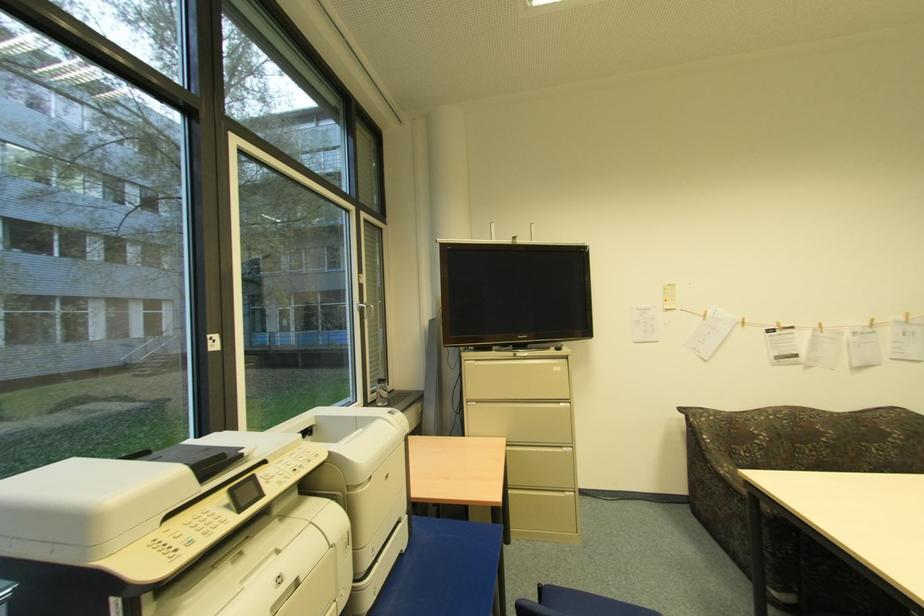
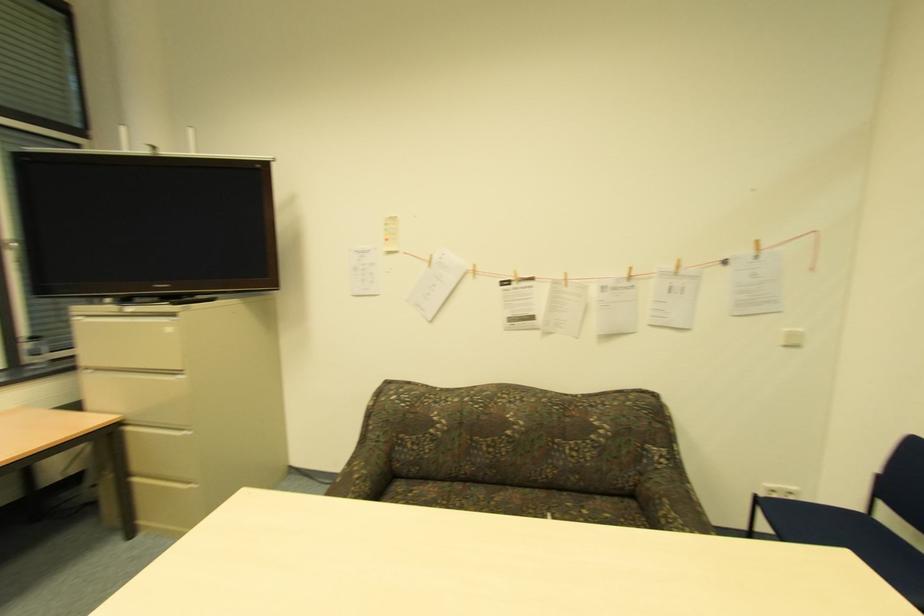
Where in the second image is the point corresponding to point (470, 403) from the first image?

(91, 370)